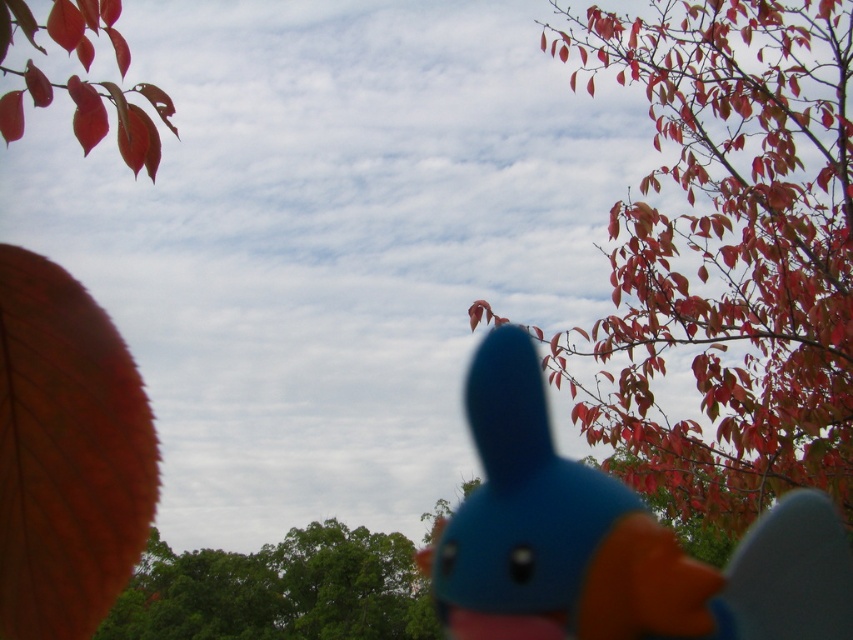
Question: Among these points, which one is nearest to the camera?

Choices:
 (A) (285, 592)
 (B) (619, 212)
 (C) (693, 637)

Answer: (C)

Question: Is smooth red leaves at upper right behind blue rubber duck at center?

Choices:
 (A) yes
 (B) no

Answer: (A)

Question: Which point is farther to the camera?

Choices:
 (A) (466, 621)
 (B) (340, 627)
 (C) (624, 214)

Answer: (B)

Question: Does blue rubber duck at center appear on the left side of green leafy tree at lower left?

Choices:
 (A) no
 (B) yes

Answer: (A)

Question: Can you confirm if smooth red leaves at upper right is wider than green leafy tree at lower left?

Choices:
 (A) yes
 (B) no

Answer: (B)

Question: Considering the real-world distances, which object is closest to the blue rubber duck at center?

Choices:
 (A) green leafy tree at lower left
 (B) smooth red leaves at upper right

Answer: (B)